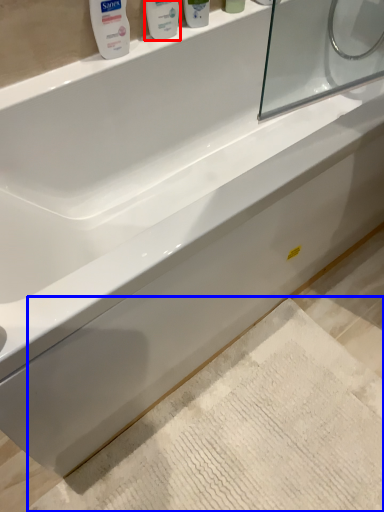
Question: Which point is closer to the camera, mouthwash (highlighted by a red box) or bath mat (highlighted by a blue box)?

Choices:
 (A) mouthwash
 (B) bath mat

Answer: (B)